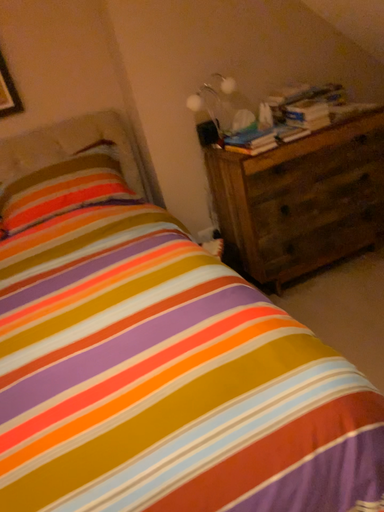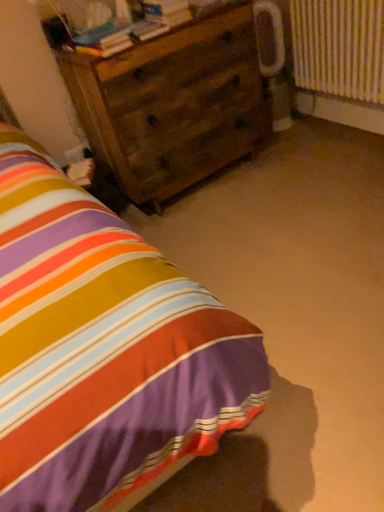
Question: How did the camera likely rotate when shooting the video?

Choices:
 (A) rotated upward
 (B) rotated downward

Answer: (B)